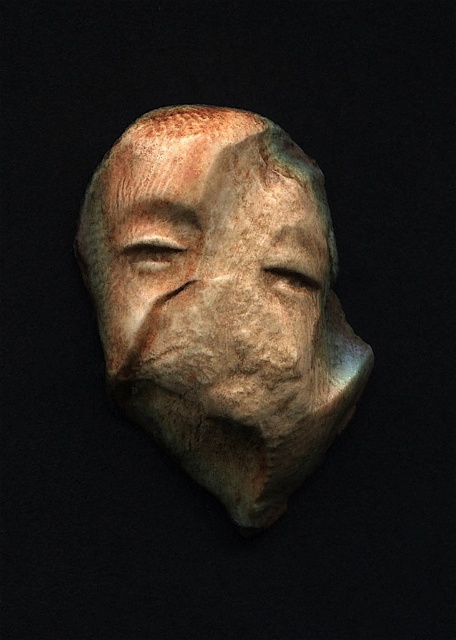
Consider the image. Is matte stone mask at center positioned before matte stone face at center?

No.

Does matte stone mask at center lie behind matte stone face at center?

Yes, it is.

Identify the location of matte stone mask at center. The width and height of the screenshot is (456, 640). (222, 300).

Identify the location of matte stone mask at center. This screenshot has width=456, height=640. (222, 300).